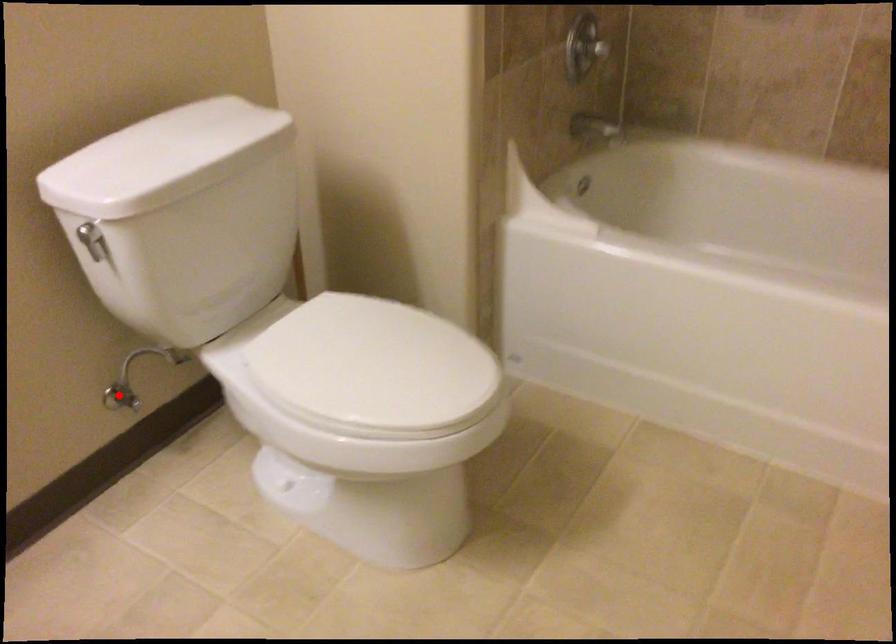
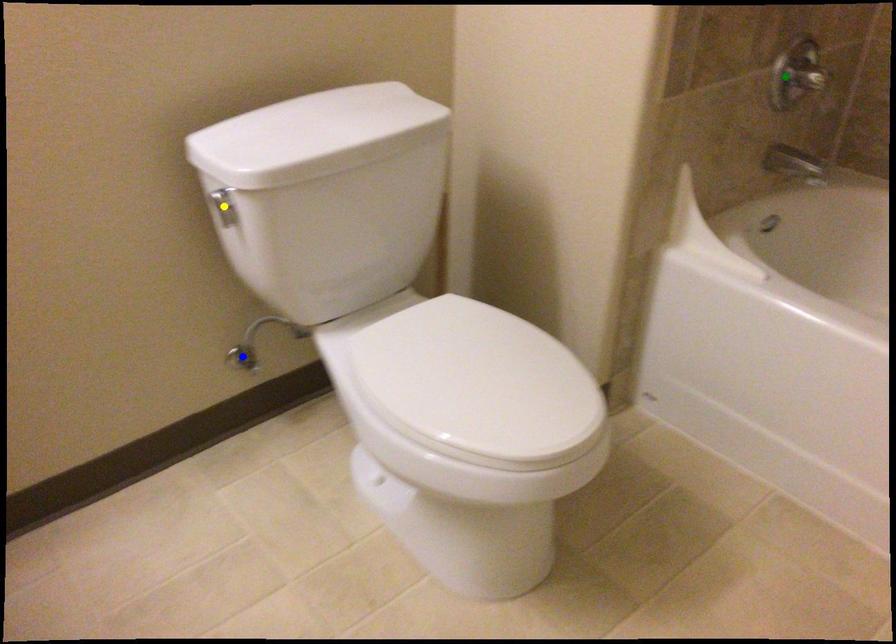
Question: I am providing you with two images of the same scene from different viewpoints. A red point is marked on the first image. You are given multiple points on the second image. Which point in image 2 represents the same 3d spot as the red point in image 1?

Choices:
 (A) blue point
 (B) green point
 (C) yellow point

Answer: (A)